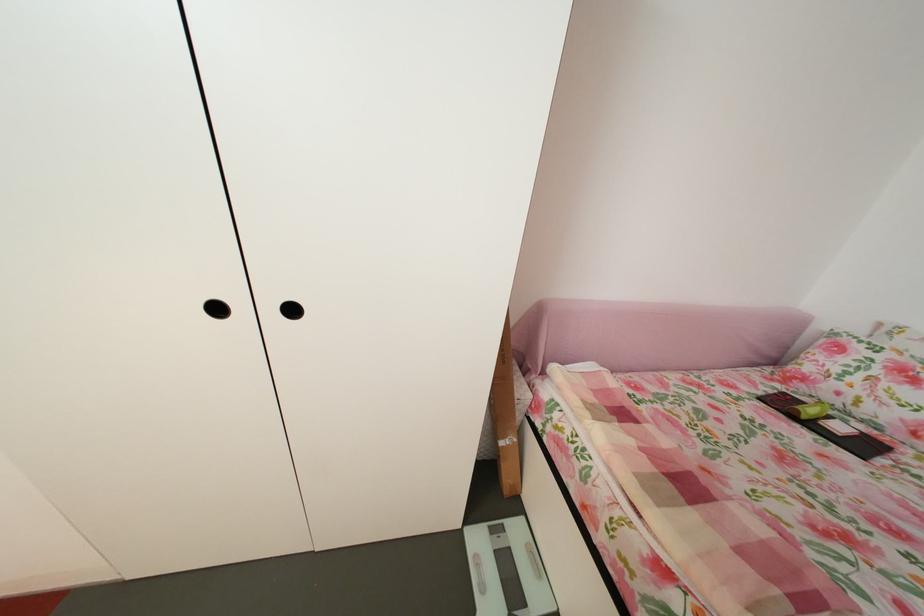
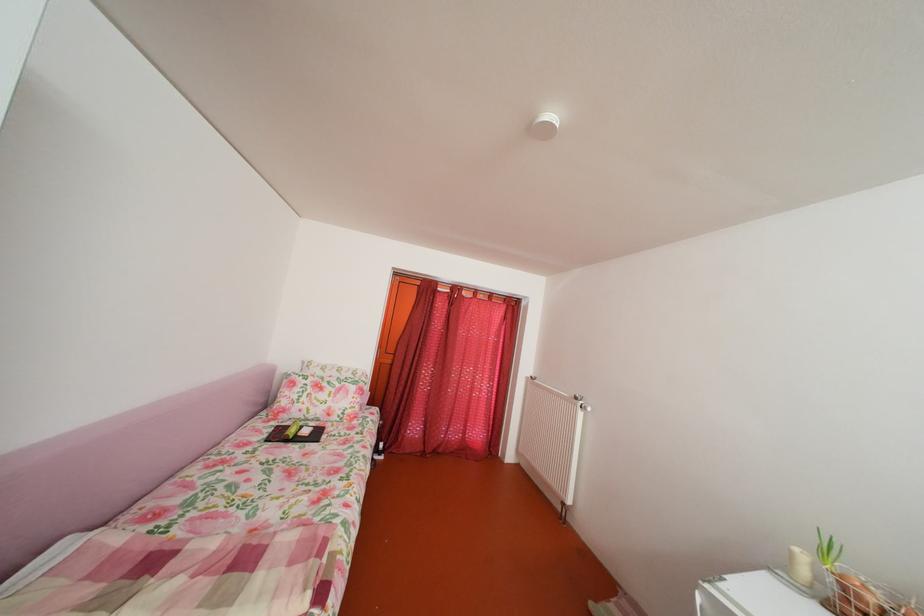
Question: Based on the continuous images, in which direction is the camera rotating? Reply with the corresponding letter.

Choices:
 (A) Left
 (B) Right
 (C) Up
 (D) Down

Answer: (B)